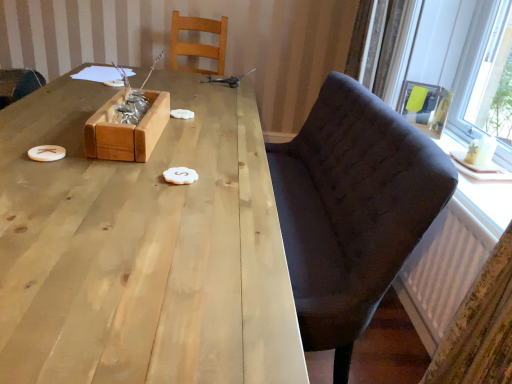
Question: Is the depth of wooden chair at left, the first chair in the left-to-right sequence, less than that of matte black armchair at upper right?

Choices:
 (A) yes
 (B) no

Answer: (B)

Question: Does wooden chair at left, which ranks as the third chair in right-to-left order, lie behind matte black armchair at upper right?

Choices:
 (A) yes
 (B) no

Answer: (A)

Question: Can you confirm if wooden chair at left, the first chair in the left-to-right sequence, is thinner than matte black armchair at upper right?

Choices:
 (A) no
 (B) yes

Answer: (A)

Question: Can we say wooden chair at left, which ranks as the third chair in right-to-left order, lies outside matte black armchair at upper right?

Choices:
 (A) no
 (B) yes

Answer: (B)

Question: Is wooden chair at left, the first chair in the left-to-right sequence, positioned with its back to matte black armchair at upper right?

Choices:
 (A) yes
 (B) no

Answer: (B)

Question: Visually, is matte black armchair at upper right positioned to the left or to the right of natural wood table at center?

Choices:
 (A) left
 (B) right

Answer: (B)

Question: Does point (430, 87) appear closer or farther from the camera than point (120, 203)?

Choices:
 (A) farther
 (B) closer

Answer: (A)

Question: Is matte black armchair at upper right wider or thinner than natural wood table at center?

Choices:
 (A) thin
 (B) wide

Answer: (A)

Question: From the image's perspective, relative to natural wood table at center, is matte black armchair at upper right above or below?

Choices:
 (A) above
 (B) below

Answer: (A)

Question: Is white matte cookie at center, marked as the second food in a right-to-left arrangement, bigger or smaller than matte black armchair at upper right?

Choices:
 (A) small
 (B) big

Answer: (A)

Question: From a real-world perspective, is white matte cookie at center, the first food in the left-to-right sequence, physically located above or below matte black armchair at upper right?

Choices:
 (A) below
 (B) above

Answer: (A)

Question: Looking at their shapes, would you say white matte cookie at center, acting as the 2th food starting from the front, is wider or thinner than matte black armchair at upper right?

Choices:
 (A) wide
 (B) thin

Answer: (A)

Question: Is white matte cookie at center, acting as the 2th food starting from the front, in front of or behind matte black armchair at upper right in the image?

Choices:
 (A) front
 (B) behind

Answer: (A)

Question: In the image, is natural wood table at center positioned in front of or behind matte black armchair at upper right?

Choices:
 (A) front
 (B) behind

Answer: (A)

Question: From their relative heights in the image, would you say natural wood table at center is taller or shorter than matte black armchair at upper right?

Choices:
 (A) tall
 (B) short

Answer: (A)